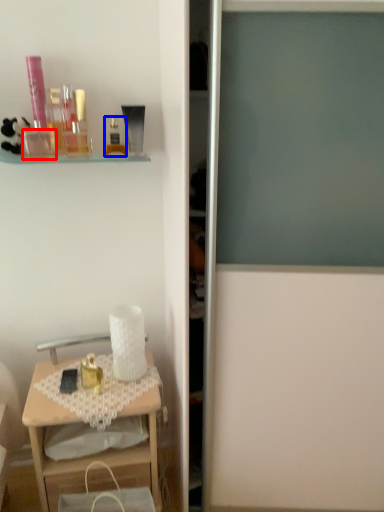
Question: Among these objects, which one is farthest to the camera, toiletry (highlighted by a red box) or toiletry (highlighted by a blue box)?

Choices:
 (A) toiletry
 (B) toiletry

Answer: (B)